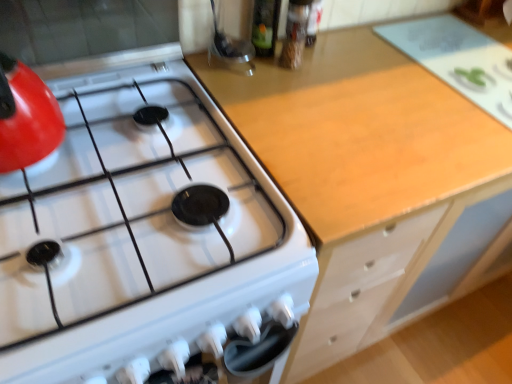
Where is `free space above light wood cabinet at center (from a real-world perspective)`? Image resolution: width=512 pixels, height=384 pixels. free space above light wood cabinet at center (from a real-world perspective) is located at coordinates (412, 82).